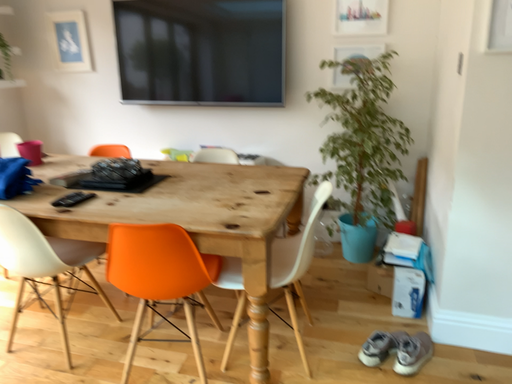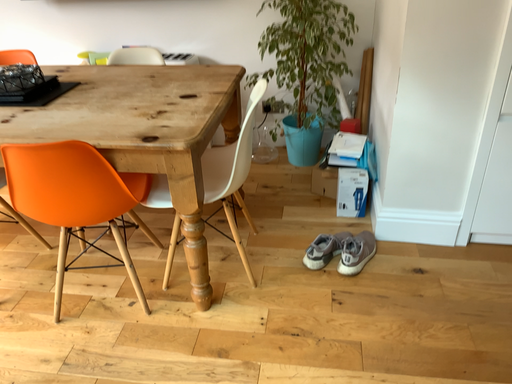
Question: Which way did the camera rotate in the video?

Choices:
 (A) rotated left
 (B) rotated right

Answer: (B)